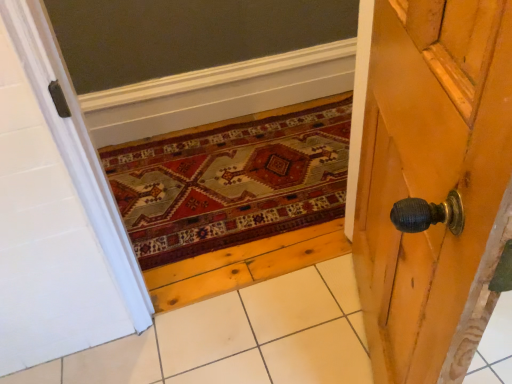
What is the approximate height of carpeted mat at center?

The height of carpeted mat at center is 1.10 inches.

Identify the location of carpeted mat at center. (232, 180).

What do you see at coordinates (232, 180) in the screenshot? I see `carpeted mat at center` at bounding box center [232, 180].

Locate an element on the screen. The width and height of the screenshot is (512, 384). carpeted mat at center is located at coordinates 232,180.